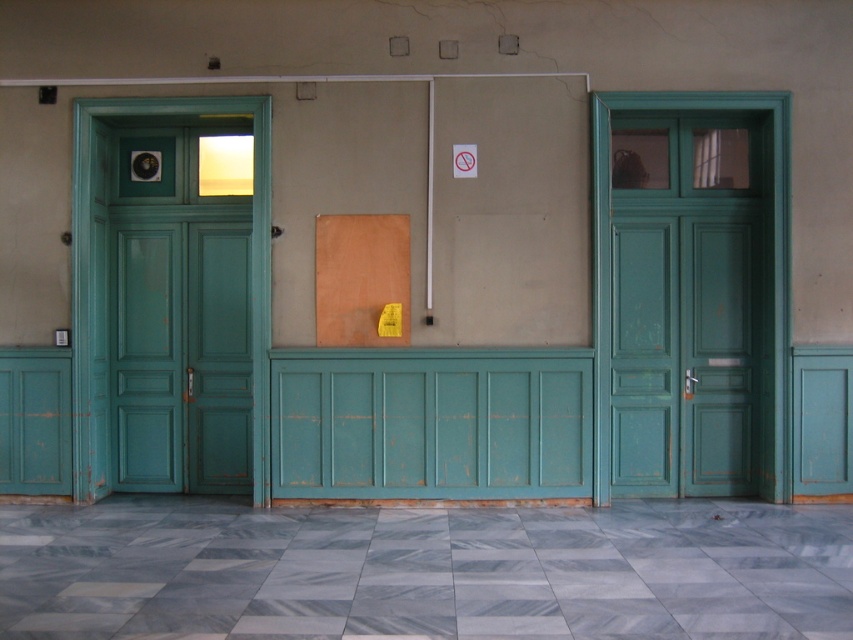
Locate an element on the screen. Image resolution: width=853 pixels, height=640 pixels. teal wooden door at right is located at coordinates (689, 292).

Is teal wooden door at right bigger than teal wooden door at left?

Correct, teal wooden door at right is larger in size than teal wooden door at left.

Does point (650, 480) come farther from viewer compared to point (178, 480)?

No, (650, 480) is closer to viewer.

Find the location of `teal wooden door at right`. teal wooden door at right is located at coordinates [x=689, y=292].